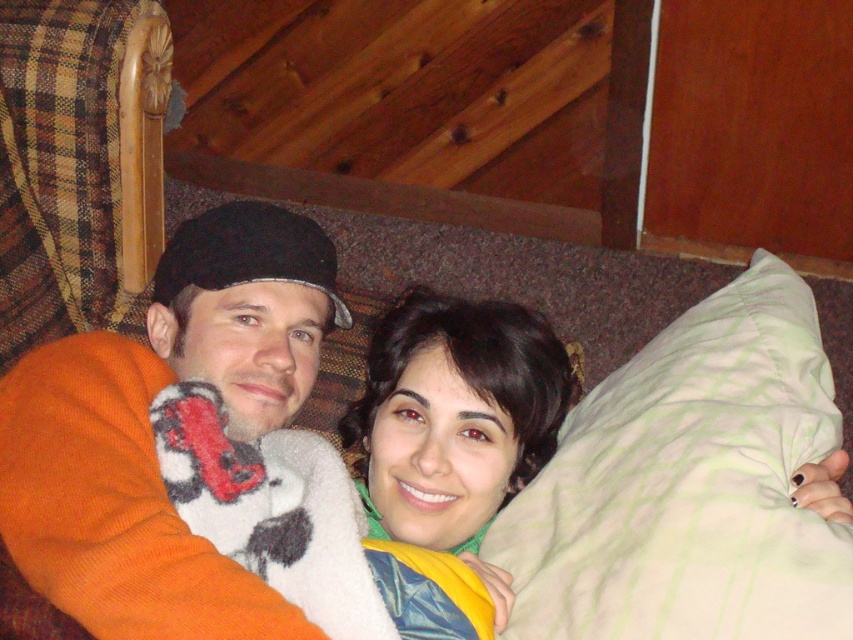
You are a photographer trying to capture a candid shot of the two people in the scene. You want to ensure that the orange fuzzy sweater at left and the dark brown hair at center are both visible in the frame. Based on their positions, which object should you prioritize framing first to ensure both are in the shot?

The orange fuzzy sweater at left is to the left of dark brown hair at center, so you should prioritize framing the orange fuzzy sweater at left first to ensure both are included in the shot.

You are taking a photo of two people sitting on a couch. You notice two points marked in the image. The first point is at coordinate point (260, 227) and the second is at point (384, 467). Based on the scene, which point is closer to the camera?

Point (260, 227) is further to the camera than point (384, 467), so the second point is closer to the camera.

You are a photographer trying to capture a candid shot of the two people sitting on the couch. You want to ensure the orange knit sweater at center and the dark brown hair at center are both in frame. Based on their positions, which object should you focus on first to capture both subjects effectively?

The orange knit sweater at center is to the left of dark brown hair at center, so focusing on the orange knit sweater at center first would allow you to frame both subjects since it is positioned to the left of the dark brown hair at center.